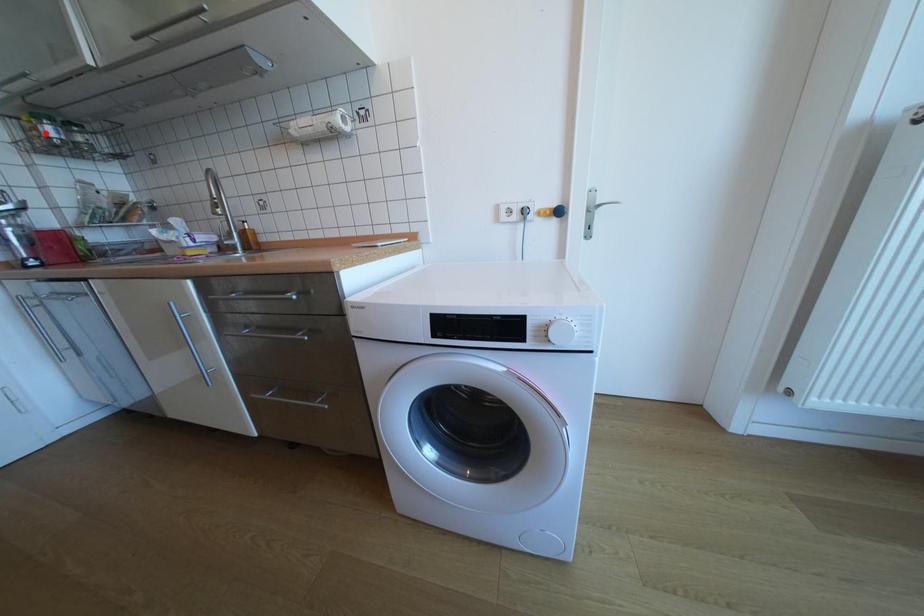
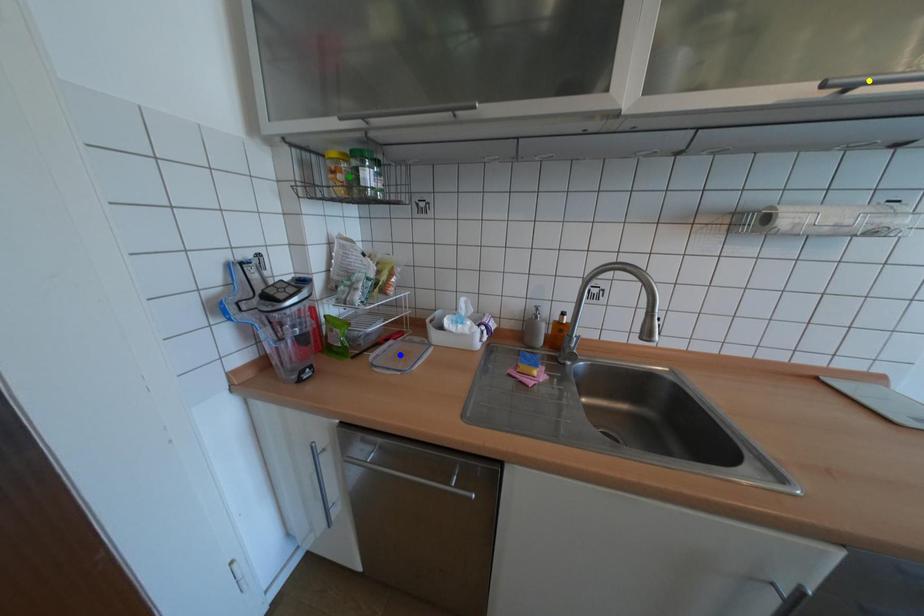
Question: I am providing you with two images of the same scene from different viewpoints. A red point is marked on the first image. You are given multiple points on the second image. Which point in image 2 represents the same 3d spot as the red point in image 1?

Choices:
 (A) blue point
 (B) green point
 (C) yellow point

Answer: (B)